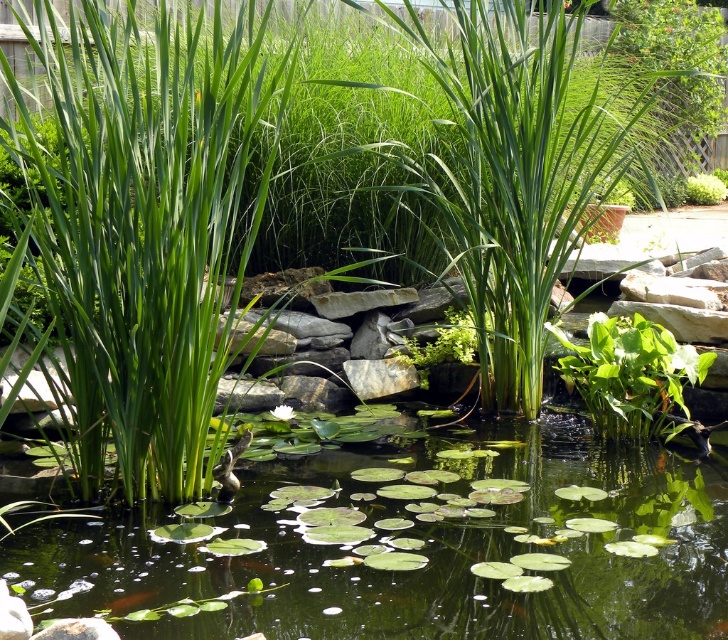
You are a gardener observing the pond and want to place a small statue between the green leafy water lilies at center and the green leafy plant at center. Which direction should you place it to ensure it is between them?

The green leafy water lilies at center is positioned on the left side of green leafy plant at center, so you should place the statue to the right of the water lilies or to the left of the plant to be between them.

You are a gardener planning to place a small statue in the pond. The statue requires a spot where the green leafy water lilies at center and the green leafy plant at center won

The green leafy water lilies at center might be wider than the green leafy plant at center, so the statue should be placed in an area where there is enough space between them to avoid overcrowding.

You are a gardener who needs to place a decorative statue between the green leafy water lilies at center and the green leafy plant at center. The statue requires a minimum of 40 inches of space between them. Can you place the statue there?

The distance between the green leafy water lilies at center and the green leafy plant at center is 39.25 inches, which is less than the required 40 inches. Therefore, the statue cannot be placed there.